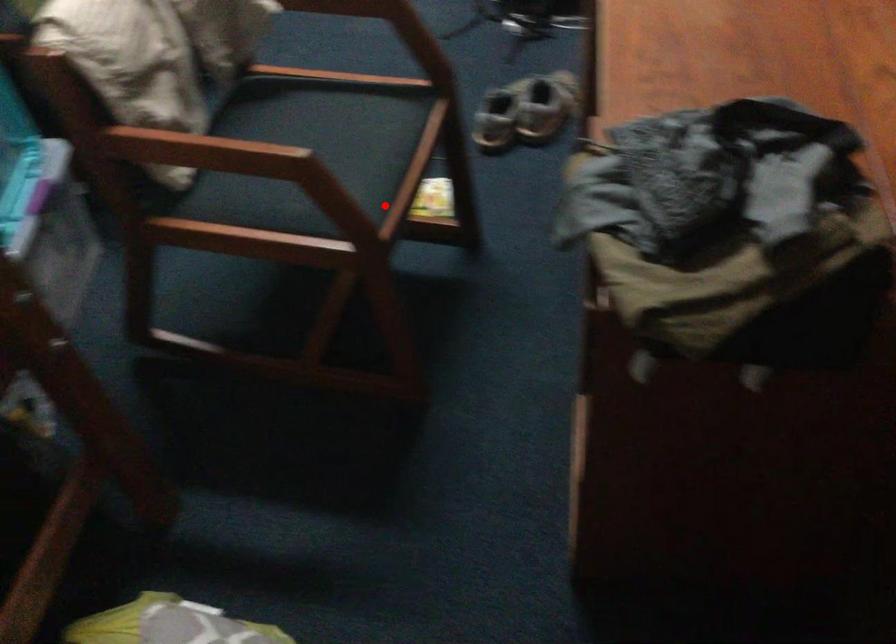
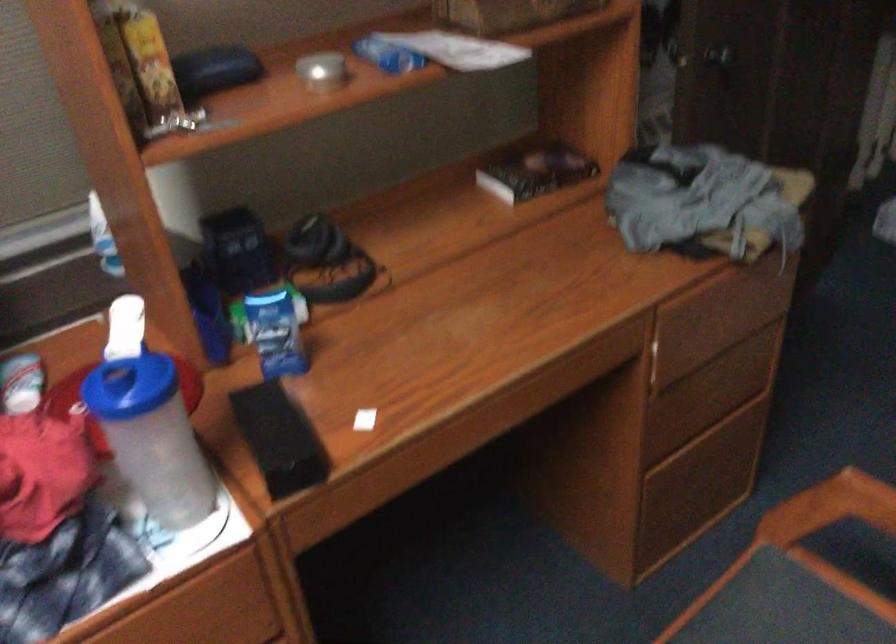
Question: I am providing you with two images of the same scene from different viewpoints. In image1, a red point is highlighted. Considering the same 3D point in image2, which of the following is correct?

Choices:
 (A) It is closer
 (B) It is farther

Answer: (A)